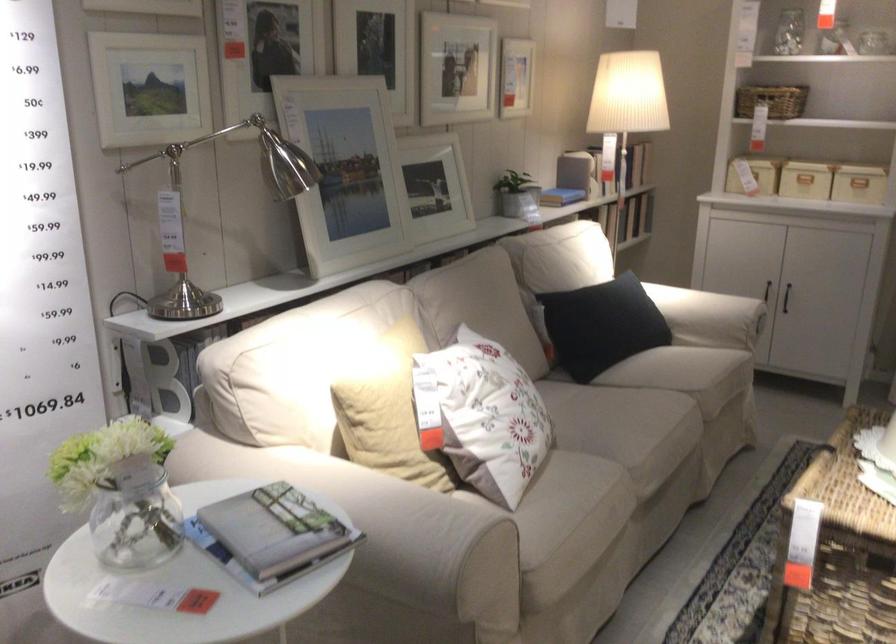
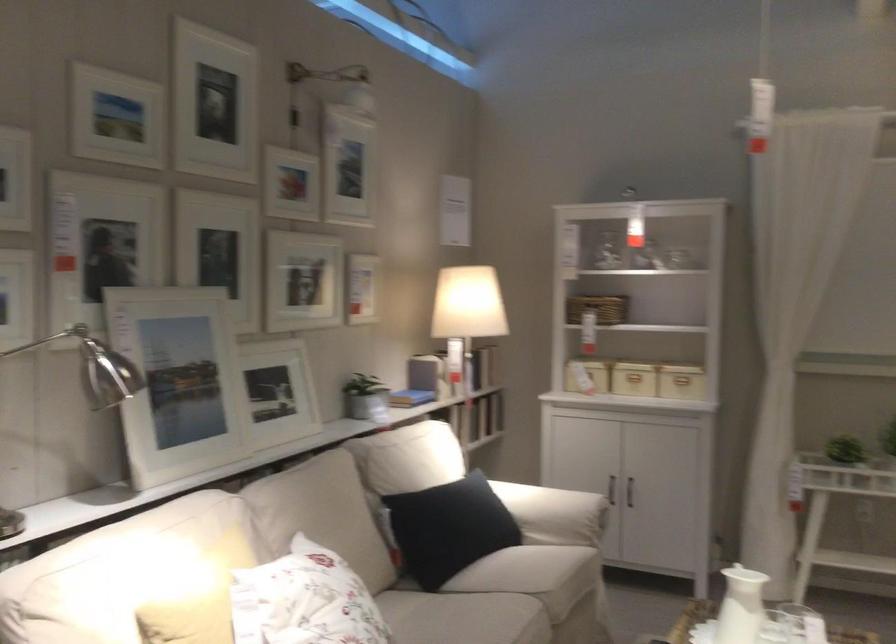
Based on the photo, what movement of the cameraman would produce the second image?

The cameraman walked toward right, backward.